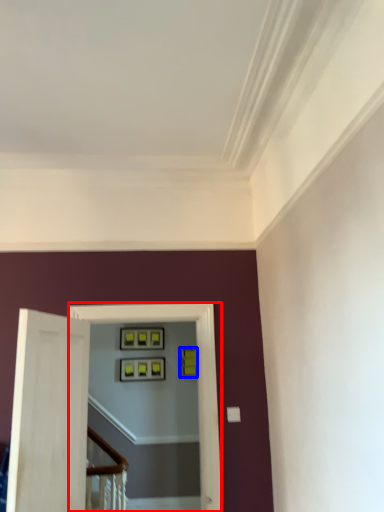
Question: Which object is closer to the camera taking this photo, passage (highlighted by a red box) or picture frame (highlighted by a blue box)?

Choices:
 (A) passage
 (B) picture frame

Answer: (A)